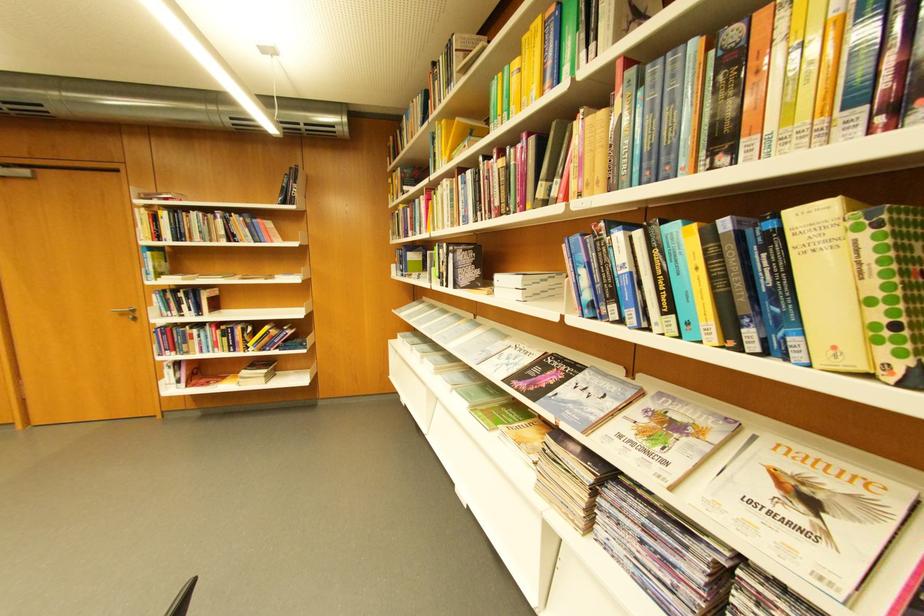
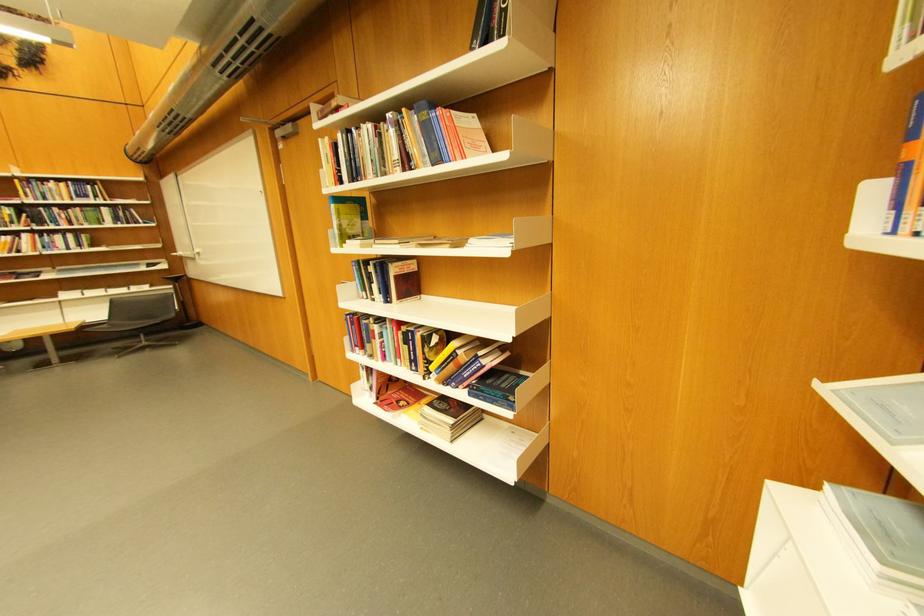
The point at (198, 217) is marked in the first image. Where is the corresponding point in the second image?

(370, 137)